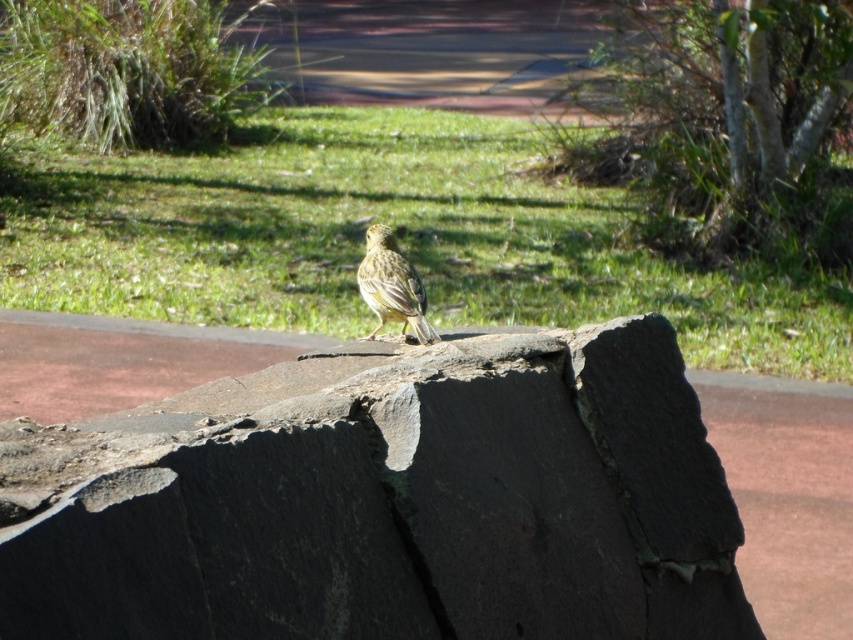
Question: Can you confirm if dark gray stone boulder at center is positioned below yellow matte sparrow at center?

Choices:
 (A) no
 (B) yes

Answer: (B)

Question: Considering the relative positions of dark gray stone boulder at center and yellow matte sparrow at center in the image provided, where is dark gray stone boulder at center located with respect to yellow matte sparrow at center?

Choices:
 (A) left
 (B) right

Answer: (A)

Question: Which point is farther from the camera taking this photo?

Choices:
 (A) (368, 300)
 (B) (699, 465)
 (C) (413, 202)

Answer: (C)

Question: Which of the following is the closest to the observer?

Choices:
 (A) dark gray stone boulder at center
 (B) yellow matte sparrow at center
 (C) green grass at center

Answer: (A)

Question: Which of these objects is positioned closest to the dark gray stone boulder at center?

Choices:
 (A) green grass at center
 (B) yellow matte sparrow at center

Answer: (B)

Question: Can you confirm if green grass at center is bigger than yellow matte sparrow at center?

Choices:
 (A) no
 (B) yes

Answer: (B)